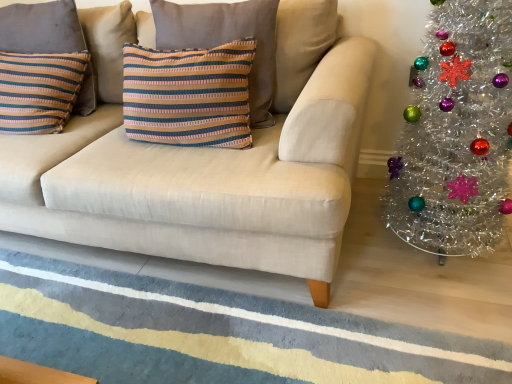
Question: Considering the positions of beige fabric couch at center and striped fabric pillow at left, marked as the second pillow in a right-to-left arrangement, in the image, is beige fabric couch at center bigger or smaller than striped fabric pillow at left, marked as the second pillow in a right-to-left arrangement,?

Choices:
 (A) small
 (B) big

Answer: (B)

Question: In the image, is beige fabric couch at center on the left side or the right side of striped fabric pillow at left, which is the 1th pillow from left to right?

Choices:
 (A) right
 (B) left

Answer: (A)

Question: Which is farther from the striped fabric pillow at center, the 2th pillow in the left-to-right sequence?

Choices:
 (A) beige fabric couch at center
 (B) textured wool rug at lower center
 (C) tinsel silver christmas tree at right
 (D) striped fabric pillow at left, marked as the second pillow in a right-to-left arrangement

Answer: (B)

Question: Based on their relative distances, which object is nearer to the textured wool rug at lower center?

Choices:
 (A) beige fabric couch at center
 (B) striped fabric pillow at left, marked as the second pillow in a right-to-left arrangement
 (C) striped fabric pillow at center, the 2th pillow in the left-to-right sequence
 (D) tinsel silver christmas tree at right

Answer: (A)